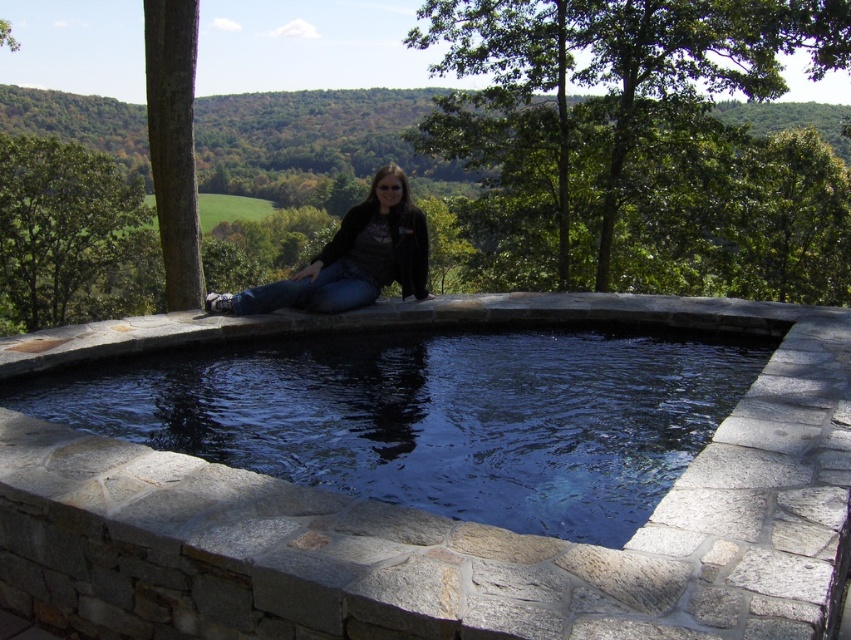
Question: Can you confirm if dark stone pool at center is positioned to the right of denim jeans at center?

Choices:
 (A) no
 (B) yes

Answer: (B)

Question: Can you confirm if dark stone pool at center is positioned below denim jeans at center?

Choices:
 (A) yes
 (B) no

Answer: (A)

Question: Can you confirm if dark stone pool at center is bigger than denim jeans at center?

Choices:
 (A) no
 (B) yes

Answer: (B)

Question: Which point appears closest to the camera in this image?

Choices:
 (A) (523, 349)
 (B) (256, 305)

Answer: (A)

Question: Among these points, which one is nearest to the camera?

Choices:
 (A) [x=264, y=298]
 (B) [x=273, y=413]

Answer: (B)